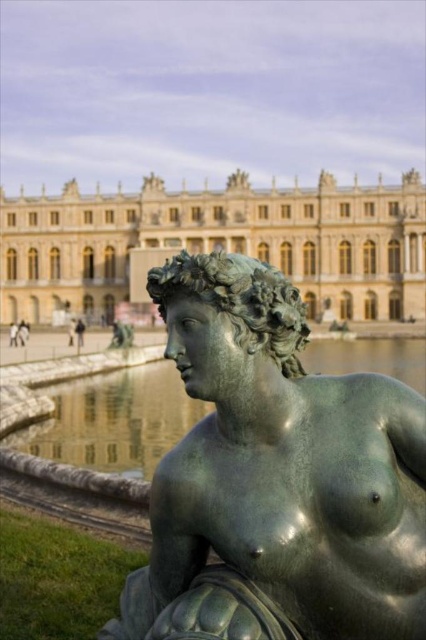
Question: Which point is closer to the camera taking this photo?

Choices:
 (A) (241, 365)
 (B) (26, 218)

Answer: (A)

Question: In this image, where is green patina statue at center located relative to green reflective water at statue right?

Choices:
 (A) below
 (B) above

Answer: (A)

Question: From the image, what is the correct spatial relationship of bronze/golden-yellow palace at upper center in relation to green reflective water at statue right?

Choices:
 (A) left
 (B) right

Answer: (A)

Question: Where is green patina statue at center located in relation to green reflective water at statue right in the image?

Choices:
 (A) below
 (B) above

Answer: (A)

Question: Which point is closer to the camera?

Choices:
 (A) (287, 465)
 (B) (98, 214)

Answer: (A)

Question: Which of the following is the farthest from the observer?

Choices:
 (A) click(158, 404)
 (B) click(210, 358)
 (C) click(276, 250)

Answer: (C)